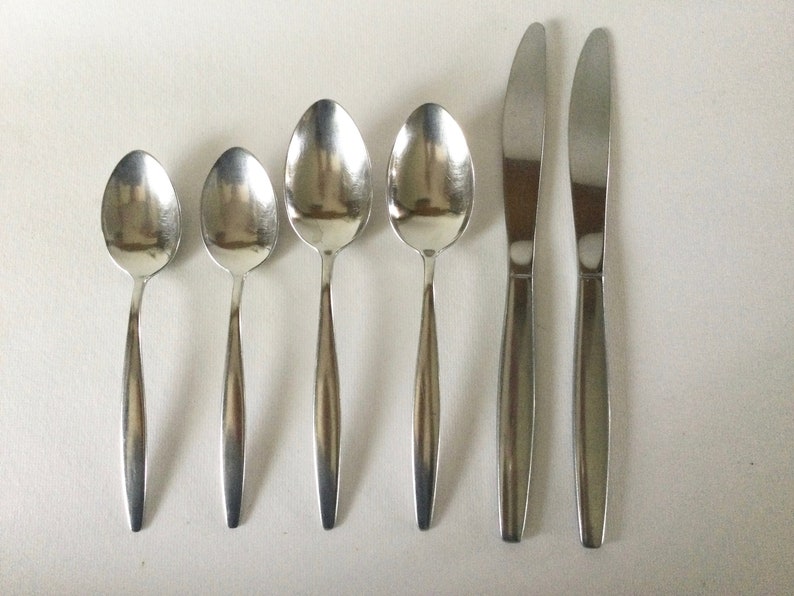
Identify the location of utensils. (133, 210), (226, 219), (326, 186), (441, 167), (525, 144), (591, 142).